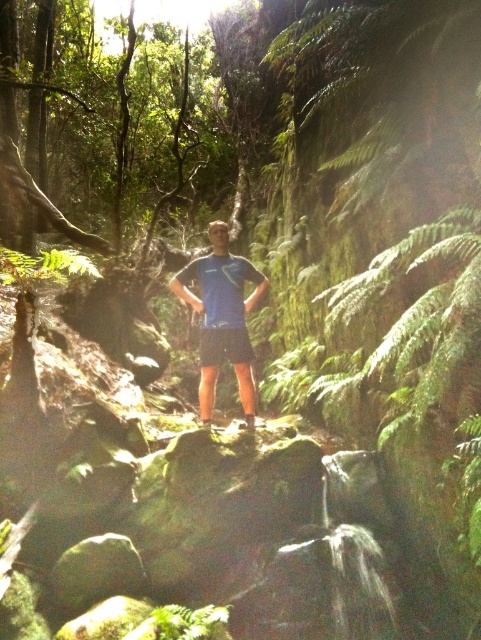
You are a photographer standing in a forest scene with a blue fabric shirt at center. You want to take a closeup shot of the shirt. Can you walk closer to the shirt to get a better shot?

The blue fabric shirt at center is 5.14 meters from viewer, so you can walk closer to it to take a better shot since it is not too far away.

You are a photographer aiming to capture a clear photo of the blue fabric shirt at center and the blue fabric shorts at center. Since you want to focus on the shirt first, which object should you adjust your camera to focus on first based on their positions?

The blue fabric shirt at center is taller than the blue fabric shorts at center, so you should focus on the blue fabric shirt at center first as it is higher in the frame.

You are a hiker who wants to ensure your clothing is properly layered. Based on the image, is the blue fabric shirt at center covering the blue fabric shorts at center?

The blue fabric shirt at center is positioned over the blue fabric shorts at center, so yes, the shirt is covering the shorts.